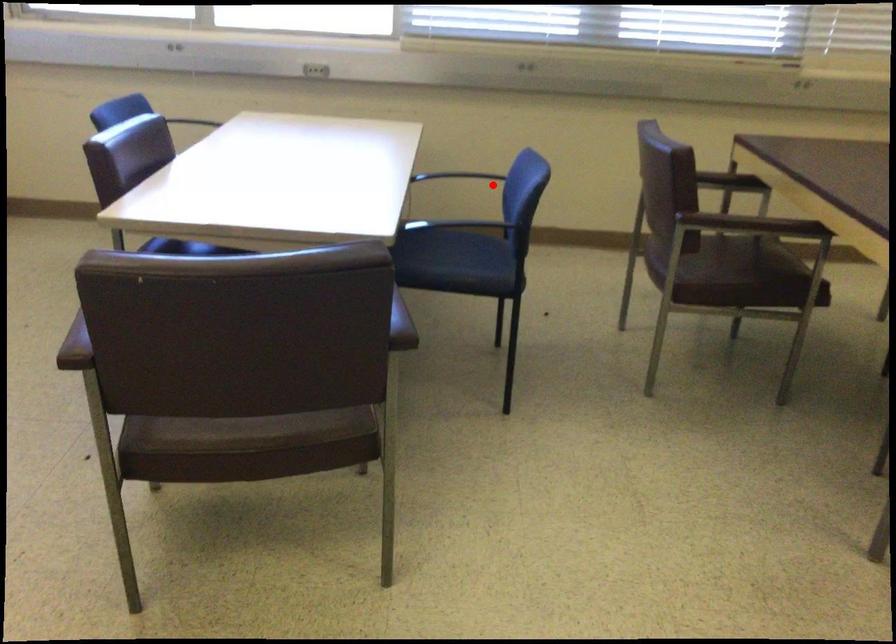
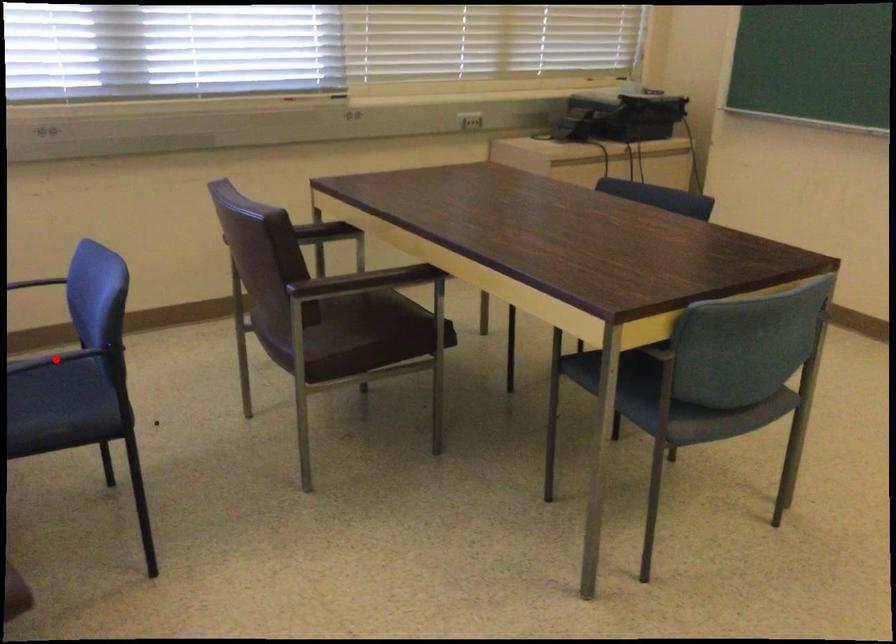
I am providing you with two images of the same scene from different viewpoints. A red point is marked on the first image and another point is marked on the second image. Is the marked point in image1 the same physical position as the marked point in image2?

No